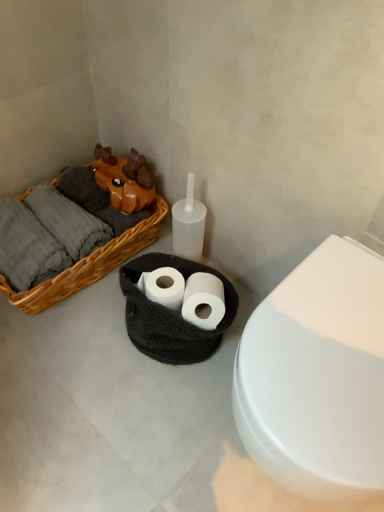
The width and height of the screenshot is (384, 512). In order to click on vacant region to the left of black crocheted basket at center in this screenshot , I will do `click(87, 348)`.